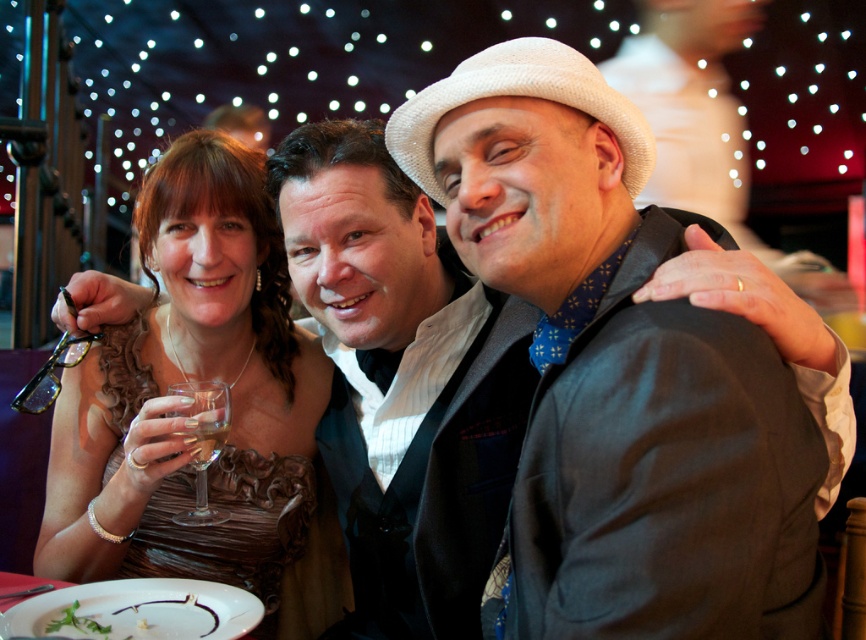
Is point (676, 499) farther from viewer compared to point (62, 624)?

That is False.

Is matte black jacket at center closer to the viewer compared to white creamy sauce at lower left?

That is True.

You are a GUI agent. You are given a task and a screenshot of the screen. Output one action in this format:
    pyautogui.click(x=<x>, y=<y>)
    Task: Click on the matte black jacket at center
    The image size is (866, 640).
    Given the screenshot: What is the action you would take?
    pyautogui.click(x=616, y=372)

In order to click on matte black jacket at center in this screenshot , I will do `click(616, 372)`.

Is white creamy sauce at lower left to the right of clear glass wine at center from the viewer's perspective?

Incorrect, white creamy sauce at lower left is not on the right side of clear glass wine at center.

Does white creamy sauce at lower left appear under clear glass wine at center?

Yes.

Is point (118, 604) positioned behind point (183, 442)?

No, it is in front of (183, 442).

The height and width of the screenshot is (640, 866). Identify the location of white creamy sauce at lower left. (133, 618).

Can you confirm if white creamy sauce at lower left is taller than clear glass wine glass at center?

Incorrect, white creamy sauce at lower left's height is not larger of clear glass wine glass at center's.

Who is more distant from viewer, (196, 612) or (186, 512)?

The point (186, 512) is behind.

Is point (78, 630) positioned behind point (192, 522)?

That is False.

What are the coordinates of `white creamy sauce at lower left` in the screenshot? It's located at (133, 618).